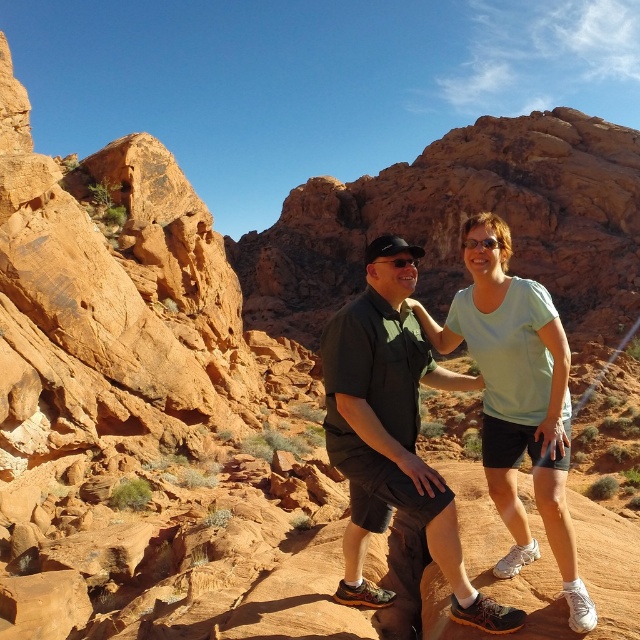
Based on the scene description, where is the matte green shirt at center located in terms of its 2D coordinates?

The matte green shirt at center is located at the 2D coordinates point (392, 435).